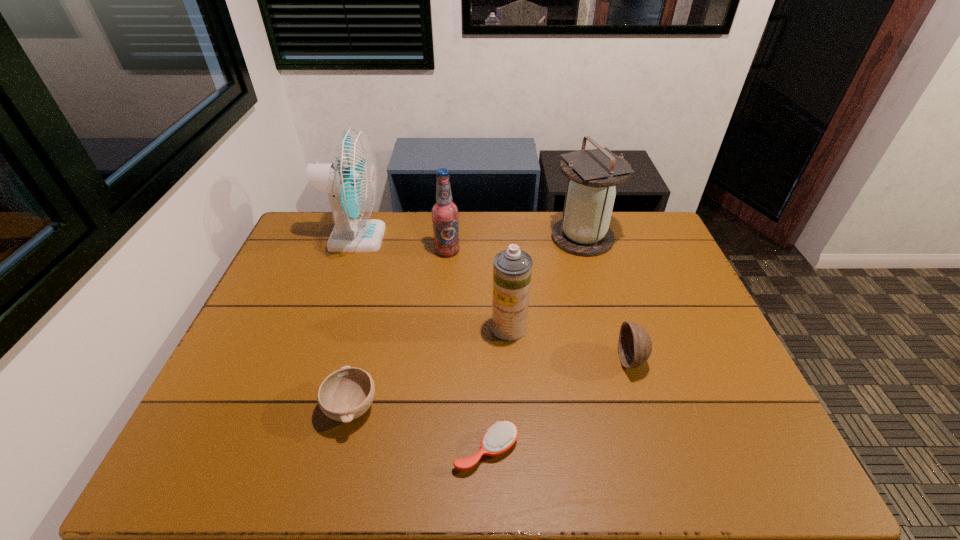
This screenshot has height=540, width=960. In order to click on vacant space that satisfies the following two spatial constraints: 1. on the back side of the lantern; 2. on the left side of the third object from left to right in this screenshot , I will do `click(448, 238)`.

Where is `blank area in the image that satisfies the following two spatial constraints: 1. on the front side of the fifth tallest object; 2. on the left side of the alcohol`? Image resolution: width=960 pixels, height=540 pixels. blank area in the image that satisfies the following two spatial constraints: 1. on the front side of the fifth tallest object; 2. on the left side of the alcohol is located at coordinates (438, 360).